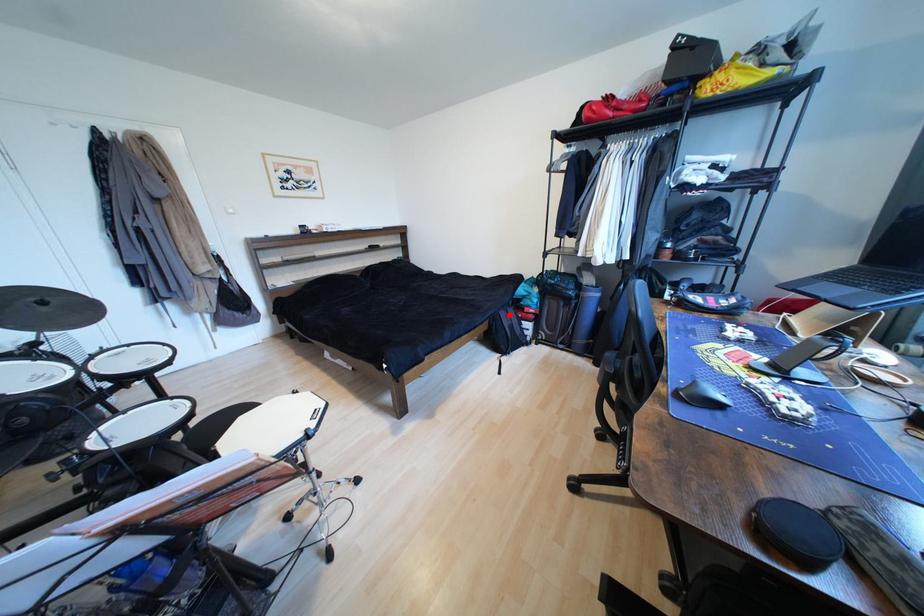
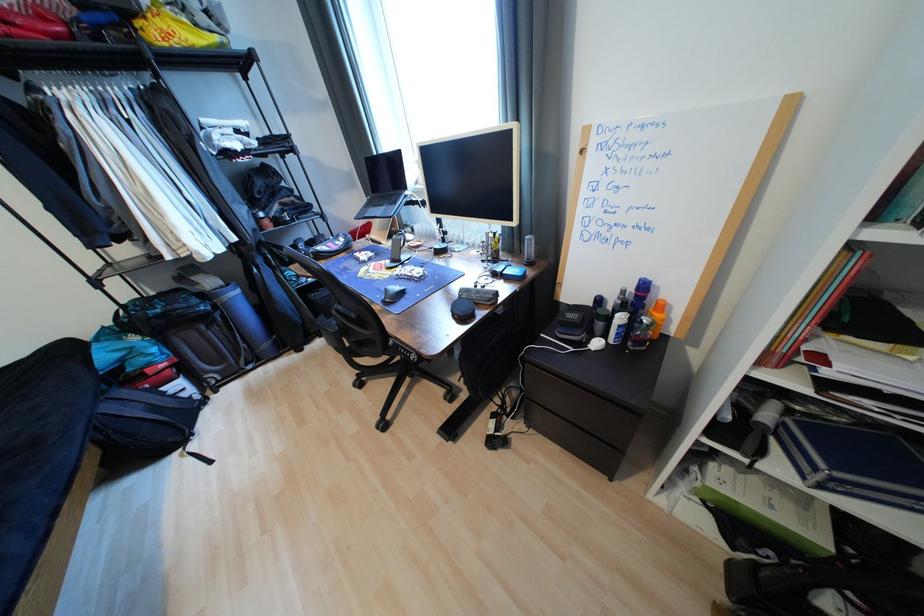
Question: I am providing you with two images of the same scene from different viewpoints. A red point is marked on the first image. Is the red point's position out of view in image 2?

Choices:
 (A) Yes
 (B) No

Answer: (B)